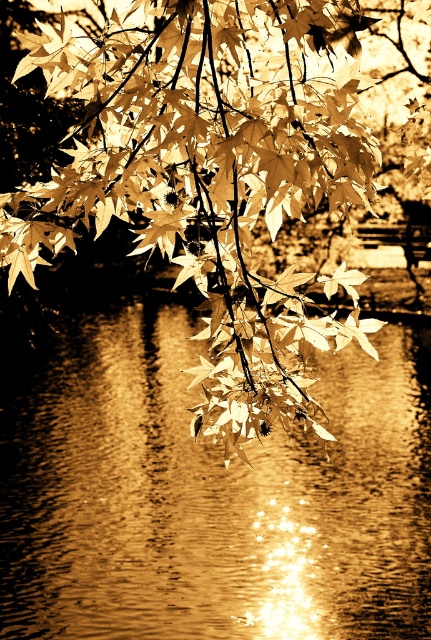
Is sepia leafy branch at upper center taller than golden textured maple leaf at center?

Yes.

Does sepia leafy branch at upper center have a greater width compared to golden textured maple leaf at center?

Indeed, sepia leafy branch at upper center has a greater width compared to golden textured maple leaf at center.

The height and width of the screenshot is (640, 431). Find the location of `sepia leafy branch at upper center`. sepia leafy branch at upper center is located at coordinates (208, 172).

Describe the element at coordinates (212, 497) in the screenshot. I see `shiny reflective water at center` at that location.

Consider the image. Does shiny reflective water at center appear on the left side of golden textured maple leaf at center?

Incorrect, shiny reflective water at center is not on the left side of golden textured maple leaf at center.

Does point (386, 440) lie in front of point (327, 288)?

That is False.

Find the location of a particular element. shiny reflective water at center is located at coordinates (212, 497).

Can you confirm if shiny reflective water at center is positioned to the right of sepia leafy branch at upper center?

Yes, shiny reflective water at center is to the right of sepia leafy branch at upper center.

What do you see at coordinates (212, 497) in the screenshot?
I see `shiny reflective water at center` at bounding box center [212, 497].

The image size is (431, 640). Identify the location of shiny reflective water at center. (212, 497).